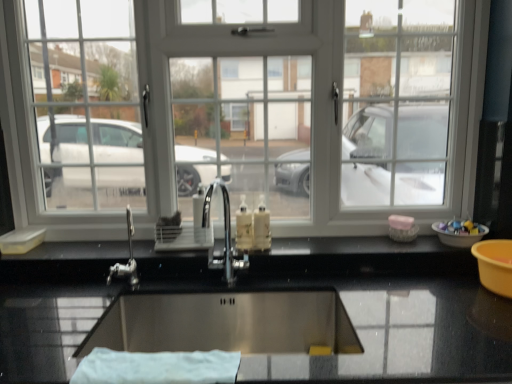
Where is `blank area beneath polished chrome tap at center (from a real-world perspective)`? blank area beneath polished chrome tap at center (from a real-world perspective) is located at coordinates (227, 284).